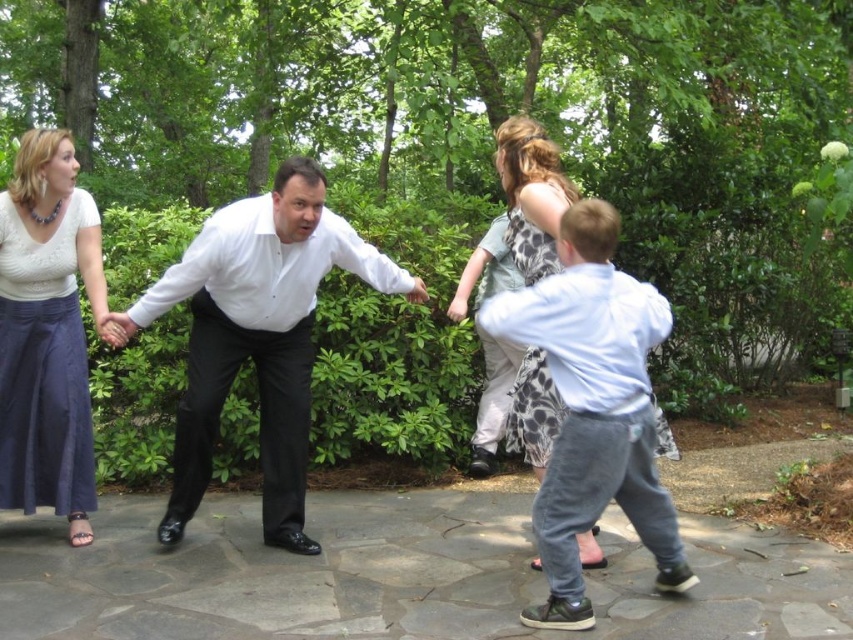
You are a photographer setting up a shoot in the garden. You have two outfits to choose from for the main character. The first is the white glossy shirt at center, and the second is the giraffe print dress at center. The client wants the outfit to appear more dominant in the photo. Which one should you choose?

The white glossy shirt at center has a larger size compared to the giraffe print dress at center, so choosing the white glossy shirt at center will make the outfit appear more dominant in the photo.

In the scene shown: You are standing at the point labeled as point (x=677, y=560) in the image. There is a hidden treasure located at point (x=294, y=252). If you want to move towards the treasure, should you walk forward or backward?

Since point (x=294, y=252) is behind point (x=677, y=560), you should walk backward to move towards the treasure.

Consider the image. You are a photographer setting up a photo shoot in the garden. You want to position the white glossy shirt at center and the giraffe print dress at center so that they are at the same height in the photo. Which object should you place on a higher platform to achieve this?

The giraffe print dress at center should be placed on a higher platform because the white glossy shirt at center is much taller than the giraffe print dress at center, so elevating the dress will balance their heights in the photo.